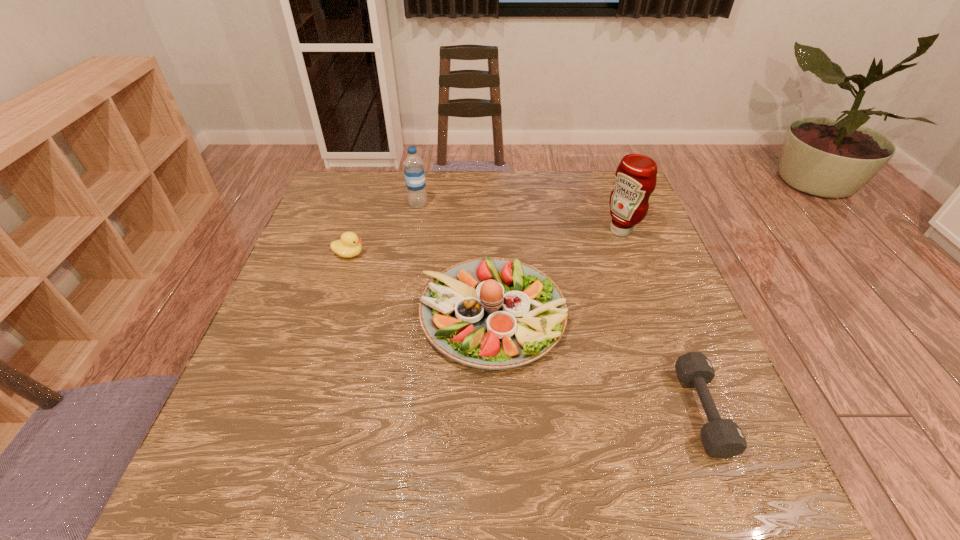
Where is `unoccupied area between the duckling and the tallest object`? Image resolution: width=960 pixels, height=540 pixels. unoccupied area between the duckling and the tallest object is located at coordinates (485, 242).

Identify the location of empty location between the second object from left to right and the leftmost object. (384, 229).

The image size is (960, 540). Find the location of `free space between the salad plate and the second object from left to right`. free space between the salad plate and the second object from left to right is located at coordinates (455, 260).

Where is `vacant space in between the salad plate and the third nearest object`? vacant space in between the salad plate and the third nearest object is located at coordinates (420, 285).

What are the coordinates of `vacant space that is in between the dumbbell and the salad plate` in the screenshot? It's located at (597, 363).

At what (x,y) coordinates should I click in order to perform the action: click on object that can be found as the second closest to the third object from left to right. Please return your answer as a coordinate pair (x, y). Looking at the image, I should click on (636, 176).

Identify which object is the third closest to the third object from left to right. Please provide its 2D coordinates. Your answer should be formatted as a tuple, i.e. [(x, y)], where the tuple contains the x and y coordinates of a point satisfying the conditions above.

[(722, 438)]

Find the location of a particular element. The image size is (960, 540). vacant point that satisfies the following two spatial constraints: 1. on the label of the dumbbell; 2. on the right side of the second object from left to right is located at coordinates (382, 410).

Where is `vacant position in the image that satisfies the following two spatial constraints: 1. on the beak of the dumbbell; 2. on the left side of the leftmost object`? The width and height of the screenshot is (960, 540). vacant position in the image that satisfies the following two spatial constraints: 1. on the beak of the dumbbell; 2. on the left side of the leftmost object is located at coordinates (299, 410).

I want to click on vacant region that satisfies the following two spatial constraints: 1. on the label of the third shortest object; 2. on the left side of the second object from left to right, so tap(398, 315).